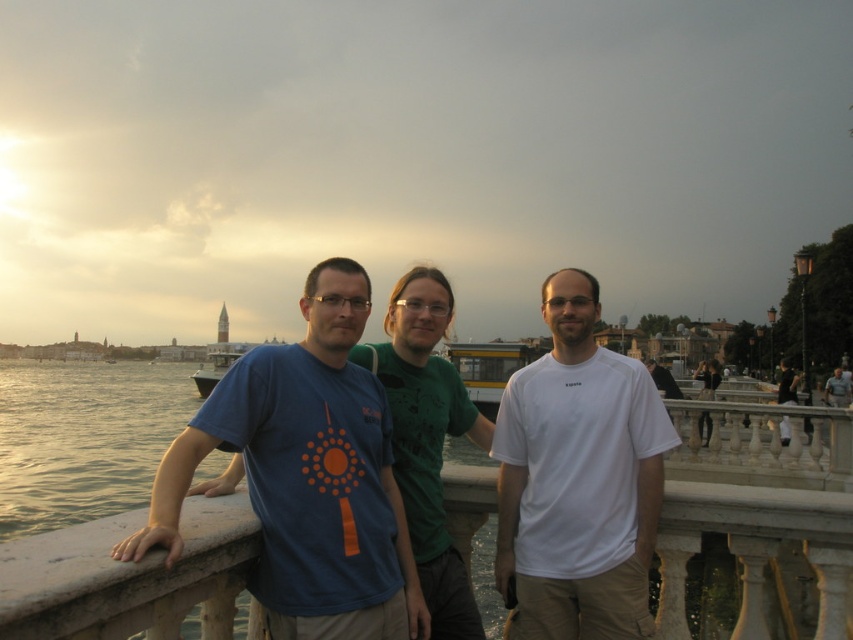
What do you see at coordinates (306, 476) in the screenshot? Image resolution: width=853 pixels, height=640 pixels. I see `matte blue t-shirt at center` at bounding box center [306, 476].

Which of these two, matte blue t-shirt at center or white matte t-shirt at center, stands shorter?

Standing shorter between the two is matte blue t-shirt at center.

Measure the distance between matte blue t-shirt at center and camera.

12.73 meters

The height and width of the screenshot is (640, 853). I want to click on matte blue t-shirt at center, so click(306, 476).